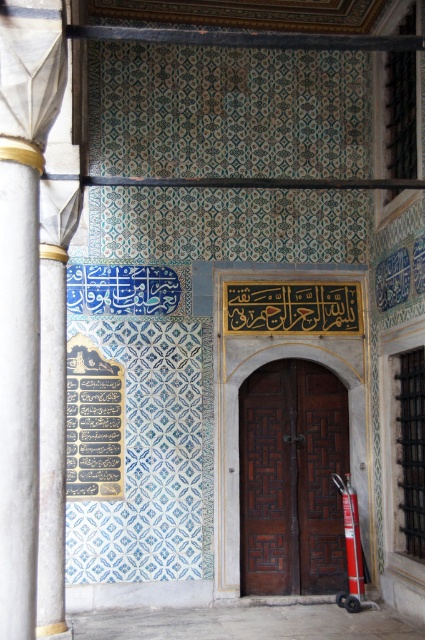
You are an architect designing a new building and want to incorporate elements from this historical wall. You have a white marble column at left and a brown wooden door at center. Which element should you choose if you want a larger structure for your design?

The brown wooden door at center is larger than the white marble column at left, so you should choose the brown wooden door at center for a larger structure in your design.

In the scene shown: You are standing in a historical building and see the white marble column at left and the brown wooden door at center. Which object is closer to you?

The white marble column at left is closer to you because it is in front of the brown wooden door at center.